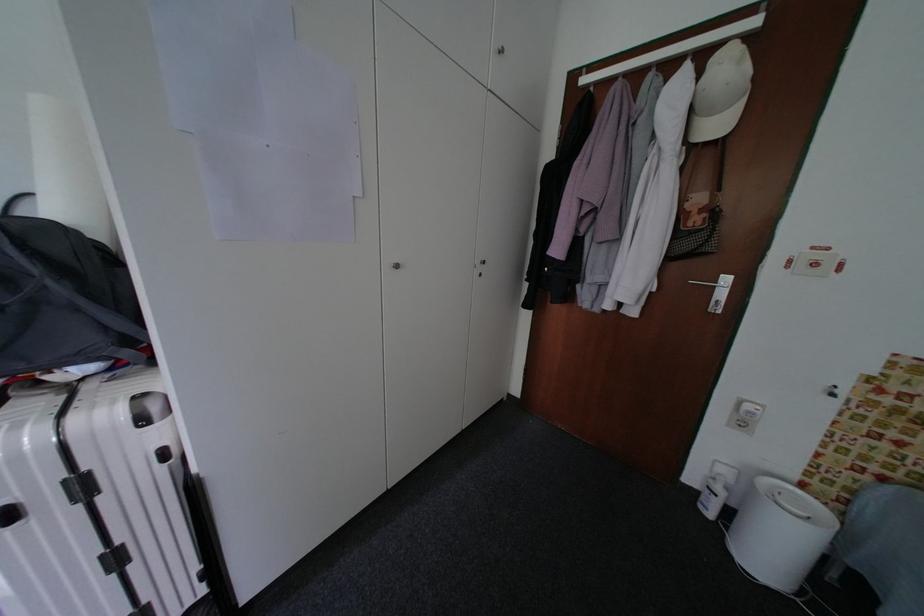
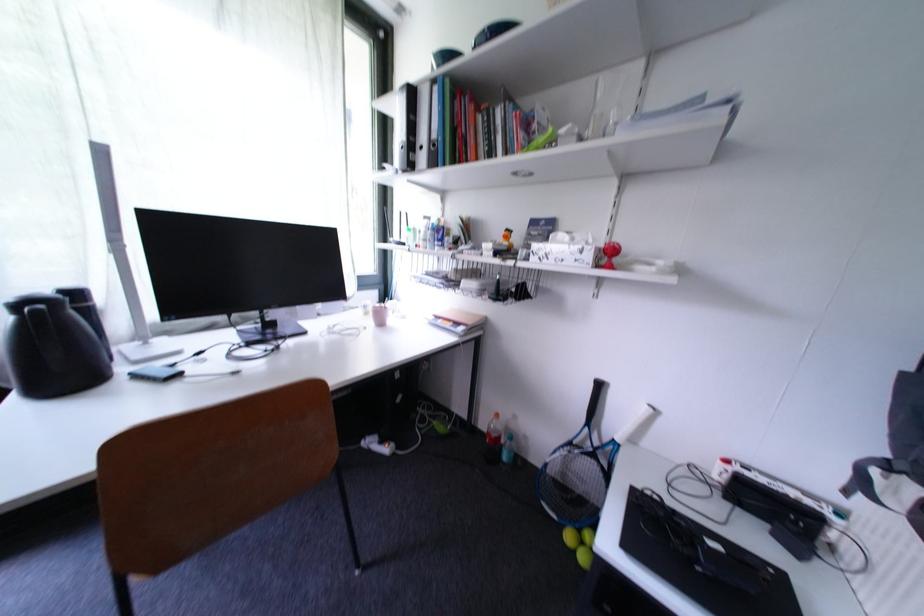
Question: How did the camera likely rotate?

Choices:
 (A) Left
 (B) Right
 (C) Up
 (D) Down

Answer: (A)